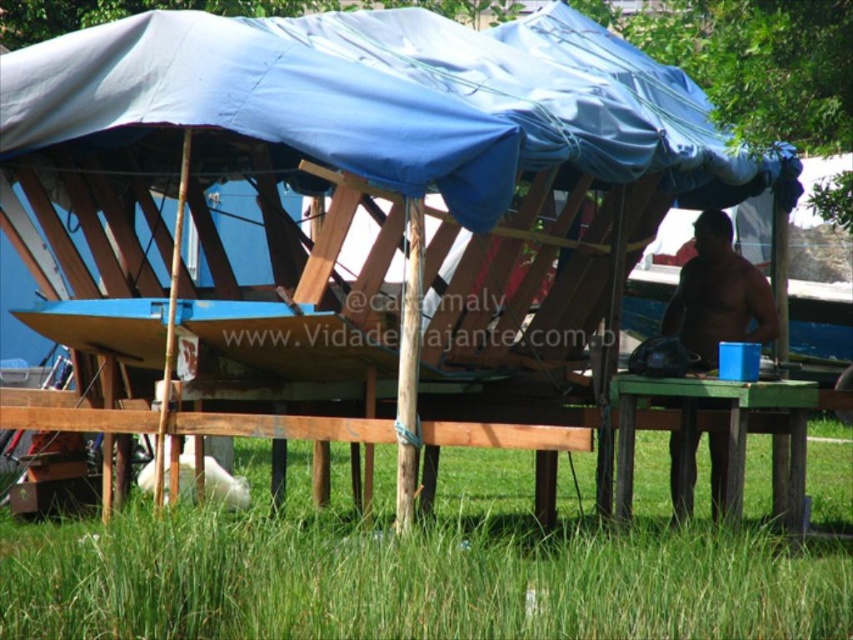
Is green grass at lower center smaller than green wooden picnic table at lower right?

Actually, green grass at lower center might be larger than green wooden picnic table at lower right.

Is point (846, 596) behind point (631, 392)?

No, it is not.

Is point (289, 598) more distant than point (798, 456)?

No.

In order to click on green grass at lower center in this screenshot , I will do `click(422, 568)`.

Can you confirm if green wooden picnic table at lower right is shorter than brown skin at right?

Correct, green wooden picnic table at lower right is not as tall as brown skin at right.

Is green wooden picnic table at lower right behind brown skin at right?

No, it is in front of brown skin at right.

Measure the distance between point [738,410] and camera.

36.55 feet

At what (x,y) coordinates should I click in order to perform the action: click on green wooden picnic table at lower right. Please return your answer as a coordinate pair (x, y). Looking at the image, I should click on (720, 438).

Can you confirm if green grass at lower center is shorter than brown skin at right?

Indeed, green grass at lower center has a lesser height compared to brown skin at right.

Between green grass at lower center and brown skin at right, which one appears on the right side from the viewer's perspective?

Positioned to the right is brown skin at right.

You are a GUI agent. You are given a task and a screenshot of the screen. Output one action in this format:
    pyautogui.click(x=<x>, y=<y>)
    Task: Click on the green grass at lower center
    The image size is (853, 640).
    Given the screenshot: What is the action you would take?
    pyautogui.click(x=422, y=568)